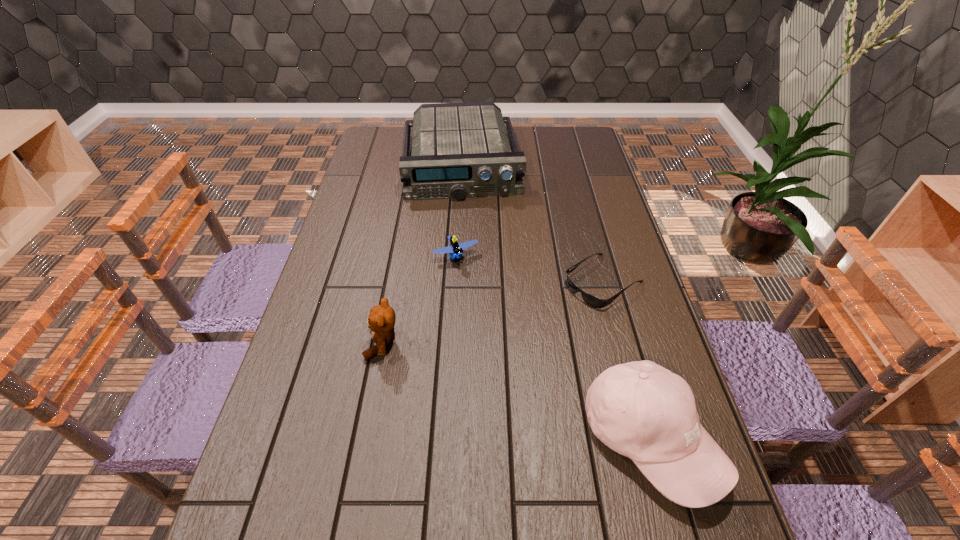
This screenshot has width=960, height=540. What are the coordinates of `free space located 0.070m on the front panel of the radio receiver` in the screenshot? It's located at (465, 214).

The width and height of the screenshot is (960, 540). I want to click on free point located on the front panel of the radio receiver, so click(467, 234).

Find the location of a particular element. vacant space situated 0.240m on the front-facing side of the shortest object is located at coordinates (x=512, y=346).

The width and height of the screenshot is (960, 540). In order to click on vacant space located on the front-facing side of the shortest object in this screenshot , I will do `click(564, 309)`.

In order to click on free location located 0.070m on the front-facing side of the shortest object in this screenshot , I will do `click(559, 312)`.

Locate an element on the screen. vacant position located 0.330m on the front-facing side of the Lego is located at coordinates (509, 359).

Identify the location of vacant space located on the front-facing side of the Lego. This screenshot has width=960, height=540. (494, 331).

The height and width of the screenshot is (540, 960). What are the coordinates of `free location located on the front-facing side of the Lego` in the screenshot? It's located at (496, 334).

Find the location of `object that is positioned at the far edge`. object that is positioned at the far edge is located at coordinates (459, 150).

Identify the location of object present at the near edge. This screenshot has height=540, width=960. (639, 409).